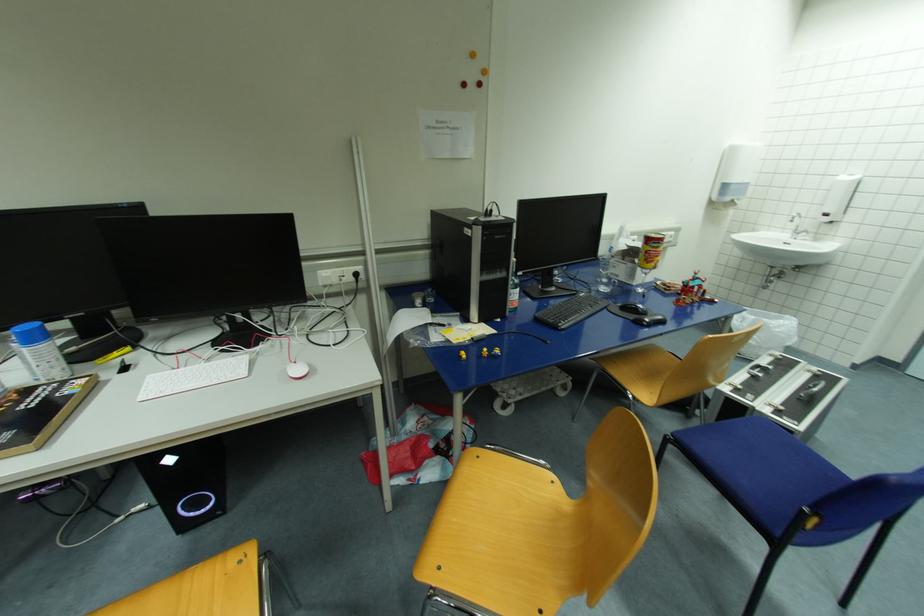
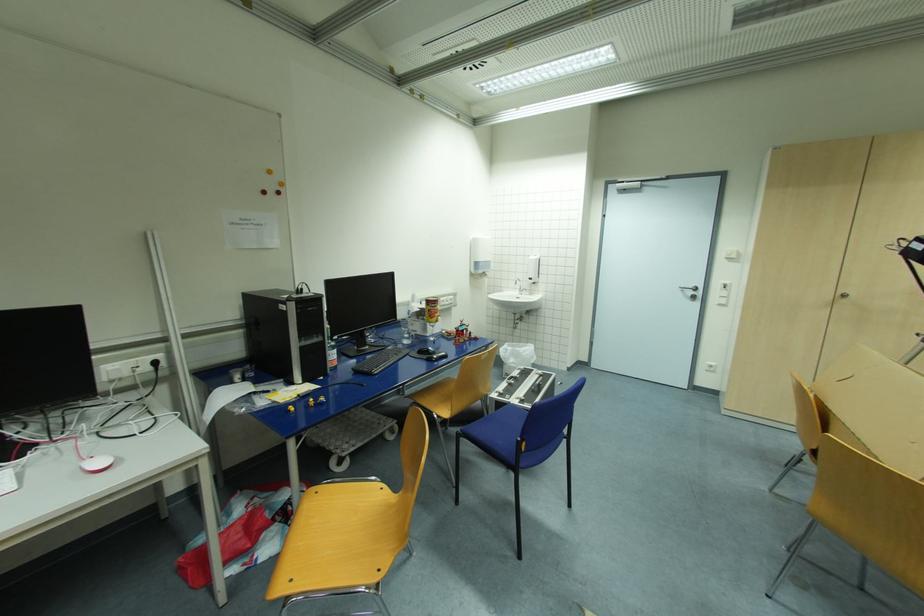
The point at (799, 233) is marked in the first image. Where is the corresponding point in the second image?

(525, 291)